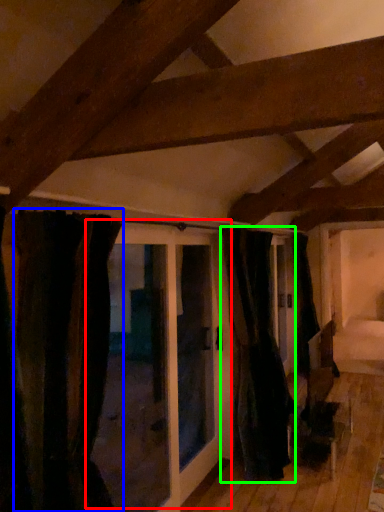
Question: Which object is the closest to the door (highlighted by a red box)? Choose among these: curtain (highlighted by a blue box) or curtain (highlighted by a green box).

Choices:
 (A) curtain
 (B) curtain

Answer: (B)